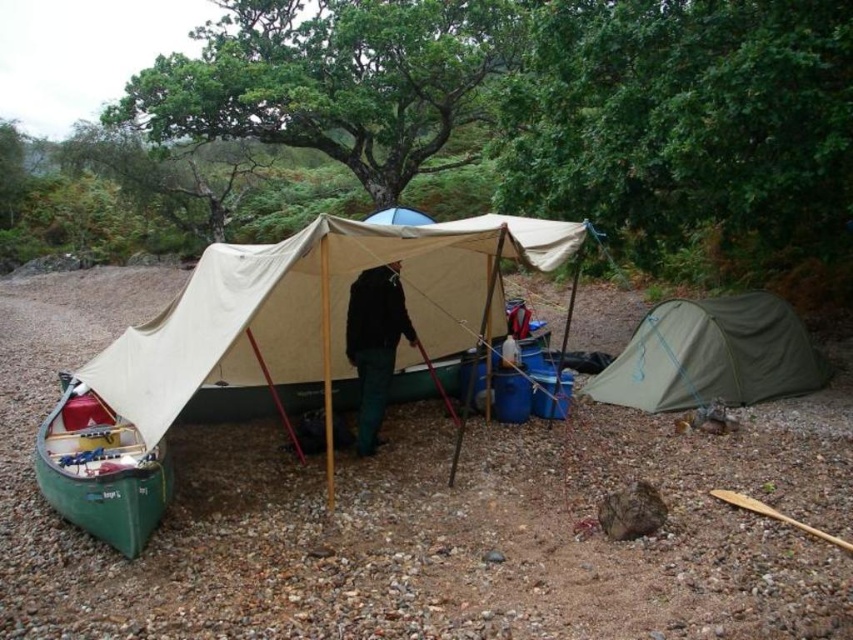
Question: Estimate the real-world distances between objects in this image. Which object is closer to the beige canvas tarp at center?

Choices:
 (A) green fabric tent at lower right
 (B) black fabric jacket at center
 (C) green matte canoe at lower left

Answer: (C)

Question: Is green matte canoe at lower left bigger than black fabric jacket at center?

Choices:
 (A) yes
 (B) no

Answer: (A)

Question: Which object is the farthest from the green matte canoe at lower left?

Choices:
 (A) black fabric jacket at center
 (B) beige canvas tarp at center
 (C) green fabric tent at lower right

Answer: (C)

Question: Is green fabric tent at lower right behind green matte canoe at lower left?

Choices:
 (A) no
 (B) yes

Answer: (B)

Question: Which of these objects is positioned closest to the green matte canoe at lower left?

Choices:
 (A) beige canvas tarp at center
 (B) black fabric jacket at center

Answer: (A)

Question: Is green fabric tent at lower right behind green matte canoe at lower left?

Choices:
 (A) yes
 (B) no

Answer: (A)